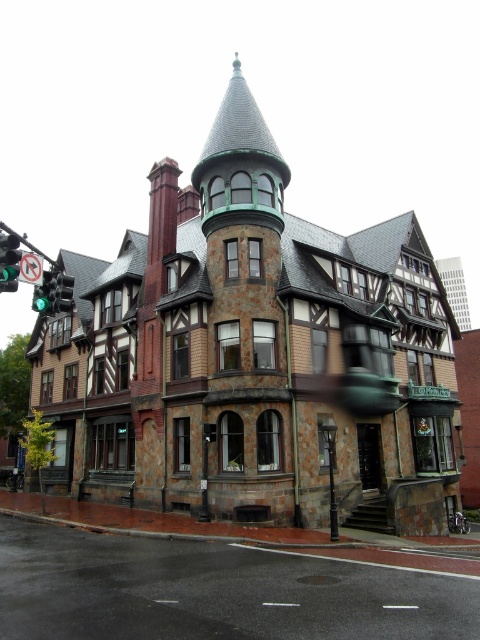
Question: Which of the following is the farthest from the observer?

Choices:
 (A) dark asphalt road at lower center
 (B) green glass traffic light at left
 (C) green glass traffic light at upper left

Answer: (B)

Question: Is dark asphalt road at lower center smaller than green glass traffic light at left?

Choices:
 (A) yes
 (B) no

Answer: (B)

Question: Among these points, which one is nearest to the camera?

Choices:
 (A) (70, 296)
 (B) (12, 269)
 (C) (74, 605)

Answer: (C)

Question: Can you confirm if green glass traffic light at upper left is positioned to the left of green glass traffic light at left?

Choices:
 (A) no
 (B) yes

Answer: (B)

Question: Where is dark asphalt road at lower center located in relation to green glass traffic light at left in the image?

Choices:
 (A) above
 (B) below

Answer: (B)

Question: Which point appears closest to the camera in this image?

Choices:
 (A) (430, 588)
 (B) (60, 305)

Answer: (A)